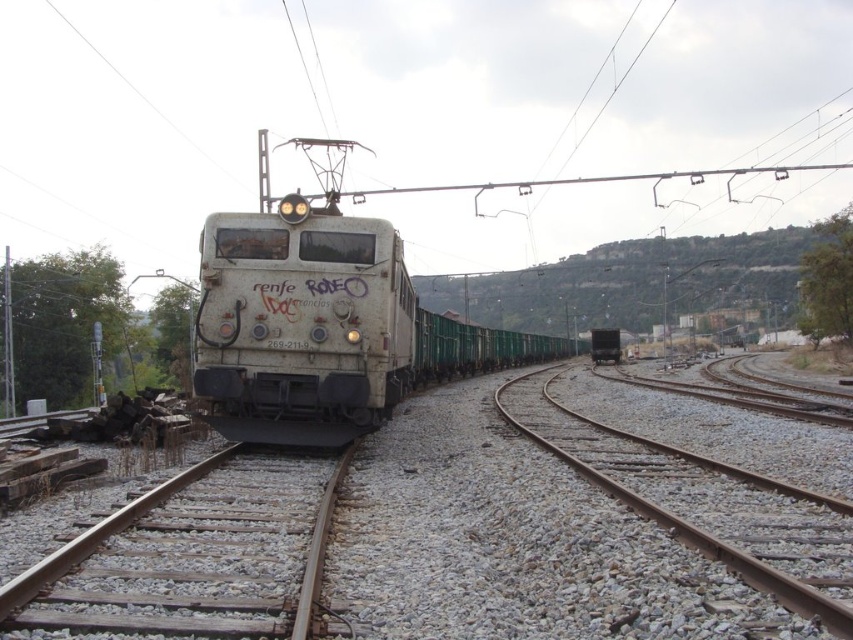
You are standing at the point with coordinates (321, 326) in the railway scene. What object are you directly at?

You are directly at the white matte train at center.

You are standing on the platform and see the white matte train at center. There is a red emergency stop button 10 meters away from you. Can you reach the button before the train arrives if you start running now?

The white matte train at center is 12.93 meters away from the red emergency stop button. Since the button is only 10 meters away from you, you can reach it before the train arrives.

You are a railway engineer inspecting the tracks. You notice the white matte train at center and the gray gravel train track at lower right. Which object is taller?

The white matte train at center is taller than the gray gravel train track at lower right according to the description.